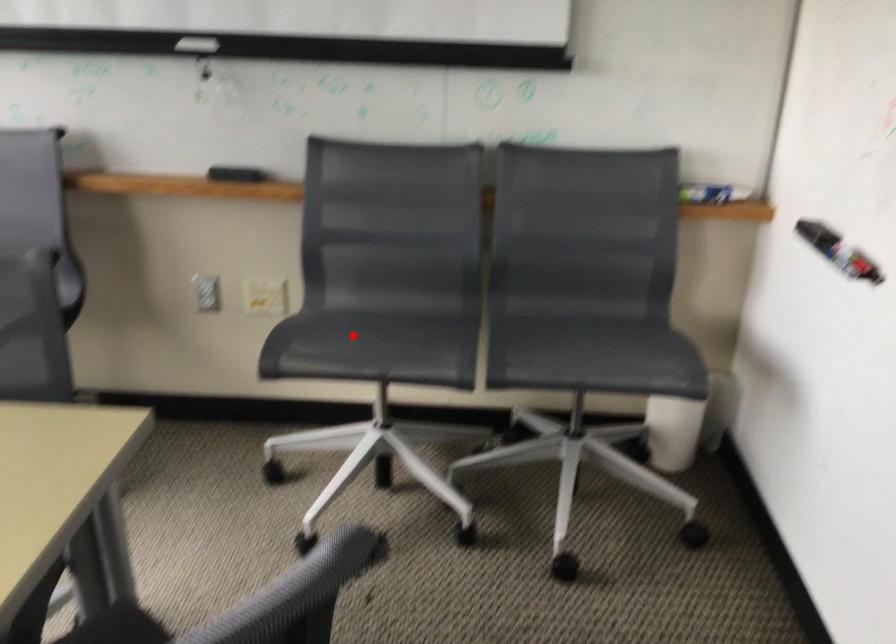
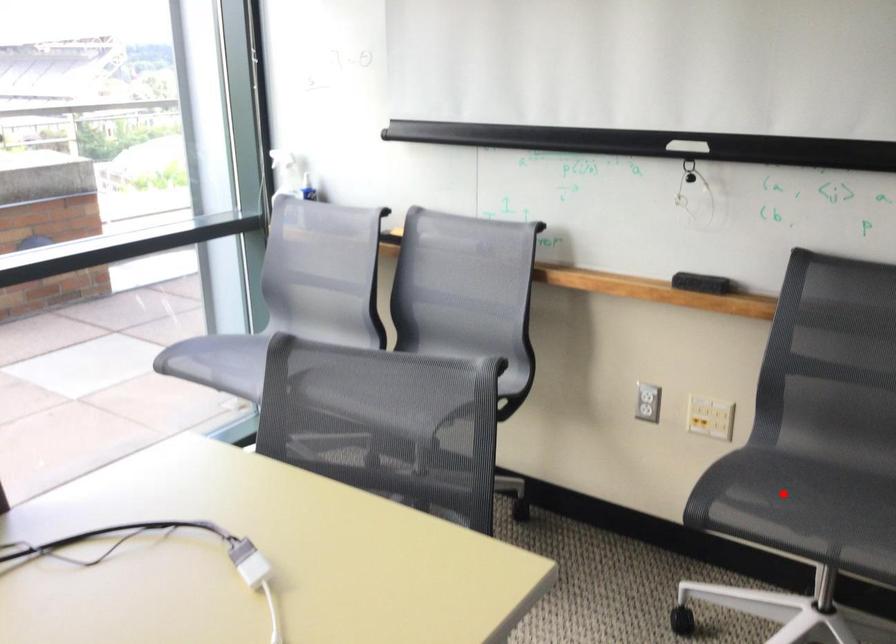
I am providing you with two images of the same scene from different viewpoints. A red point is marked on the first image and another point is marked on the second image. Is the marked point in image1 the same physical position as the marked point in image2?

Yes